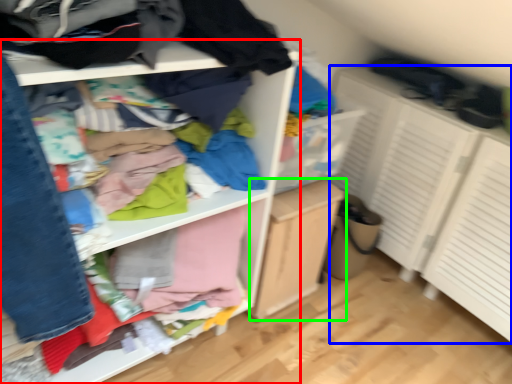
Question: Considering the real-world distances, which object is closest to shelf (highlighted by a red box)? cabinetry (highlighted by a blue box) or file cabinet (highlighted by a green box).

Choices:
 (A) cabinetry
 (B) file cabinet

Answer: (B)